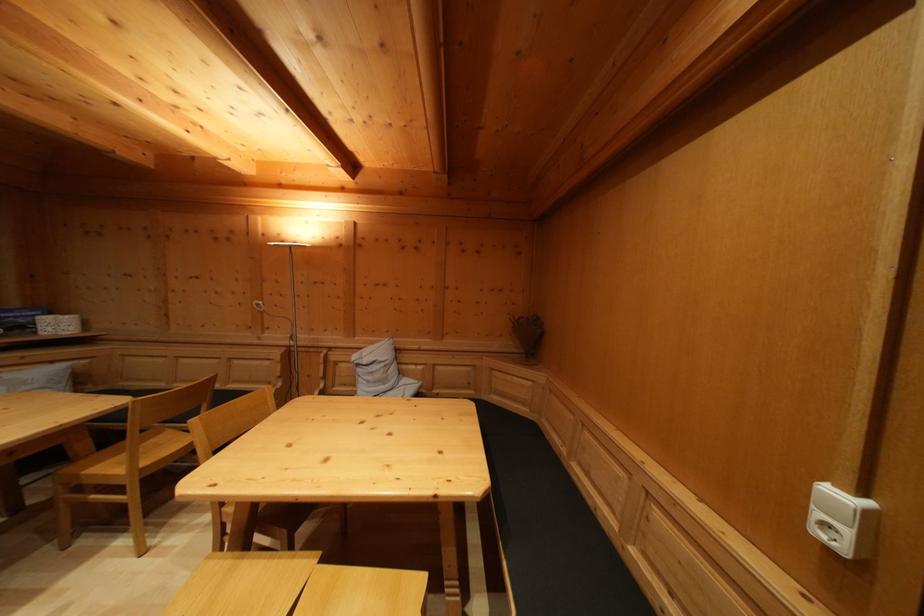
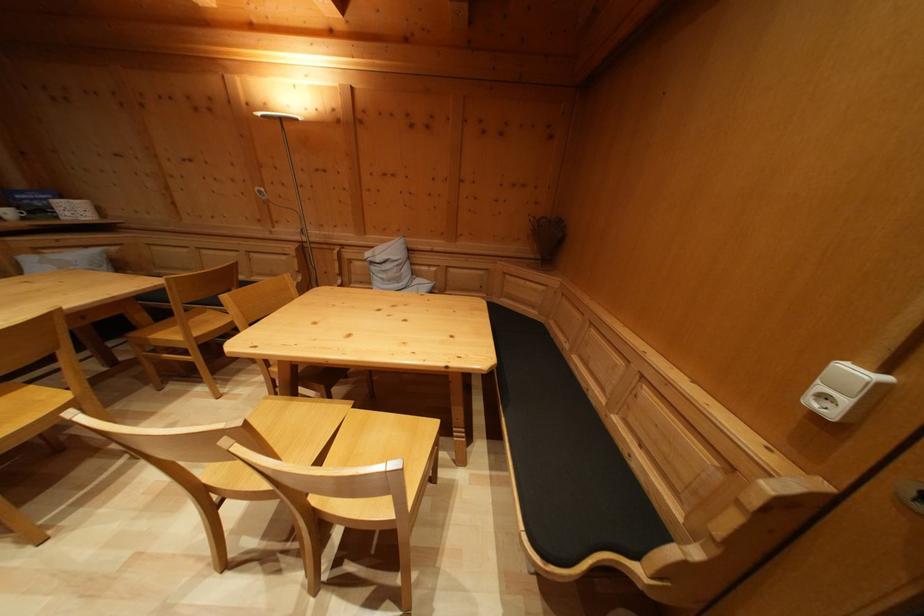
Locate, in the second image, the point that corresponds to (x=845, y=504) in the first image.

(859, 379)